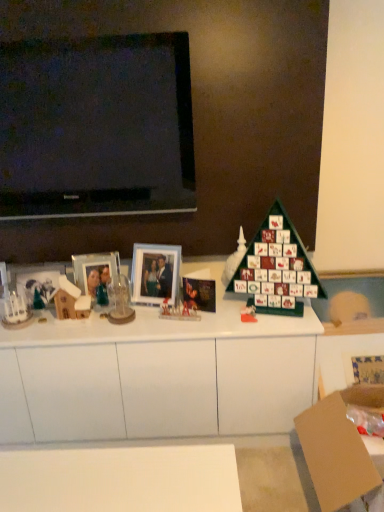
What are the coordinates of `vacant area to the right of glossy paper christmas card at center` in the screenshot? It's located at coord(234,308).